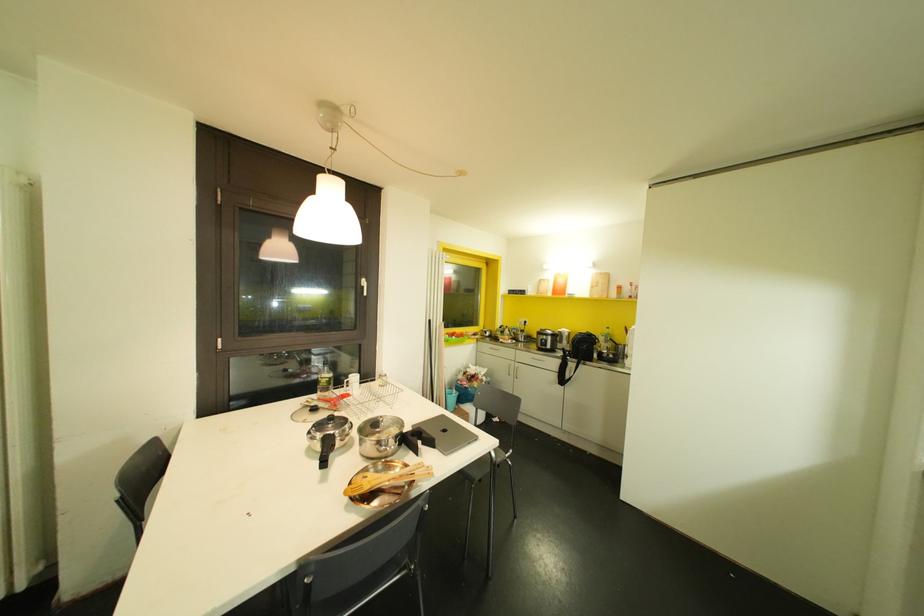
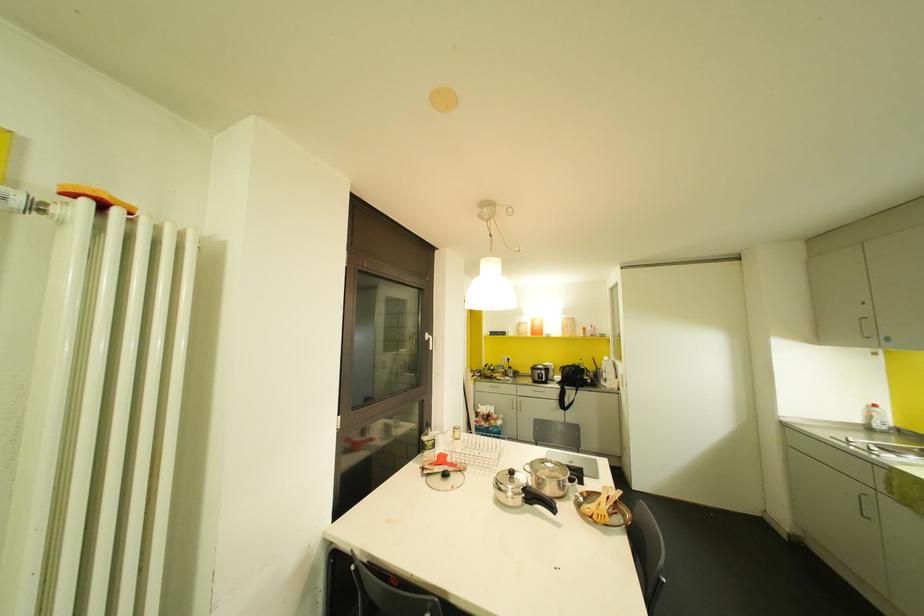
Where in the second image is the point corresponding to pixel 322 379 from the first image?

(429, 444)